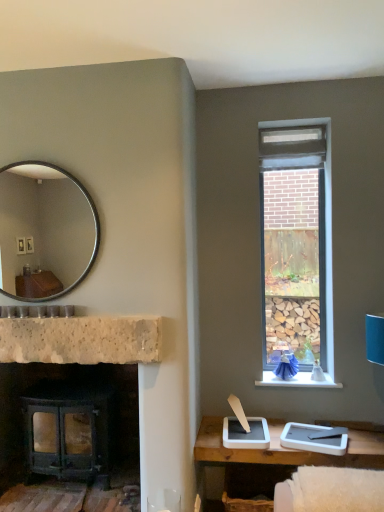
At what (x,y) coordinates should I click in order to perform the action: click on vacant space situated above silver metallic mirror at upper left (from a real-world perspective). Please return your answer as a coordinate pair (x, y). The width and height of the screenshot is (384, 512). Looking at the image, I should click on (43, 159).